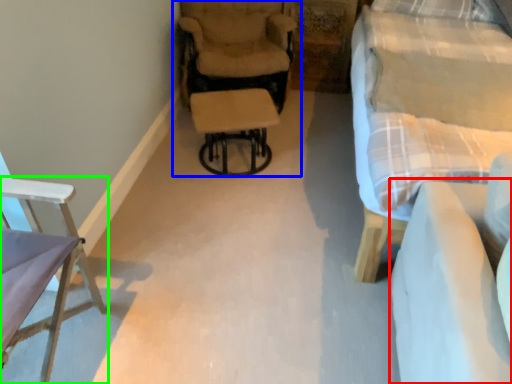
Question: Based on their relative distances, which object is farther from couch (highlighted by a red box)? Choose from chair (highlighted by a blue box) and chair (highlighted by a green box).

Choices:
 (A) chair
 (B) chair

Answer: (A)